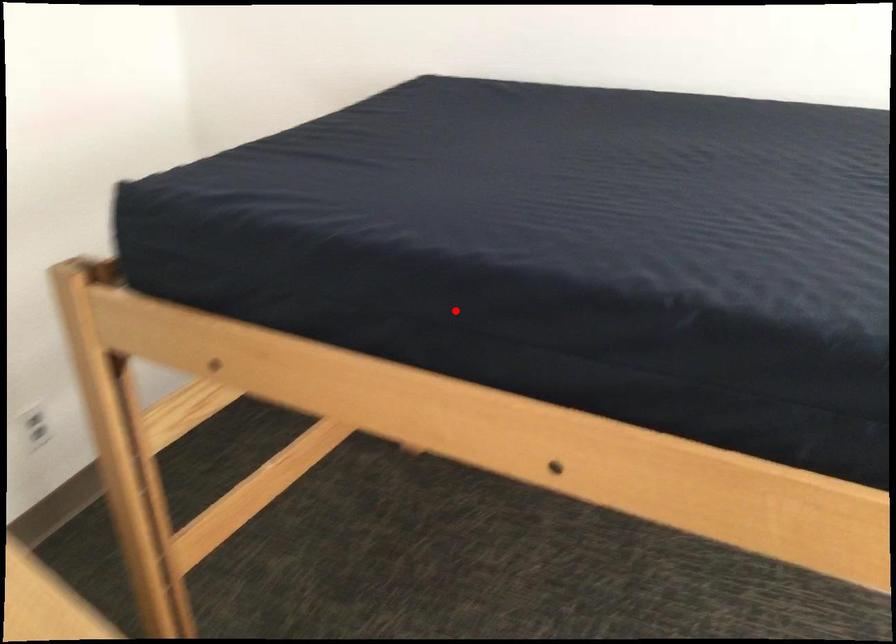
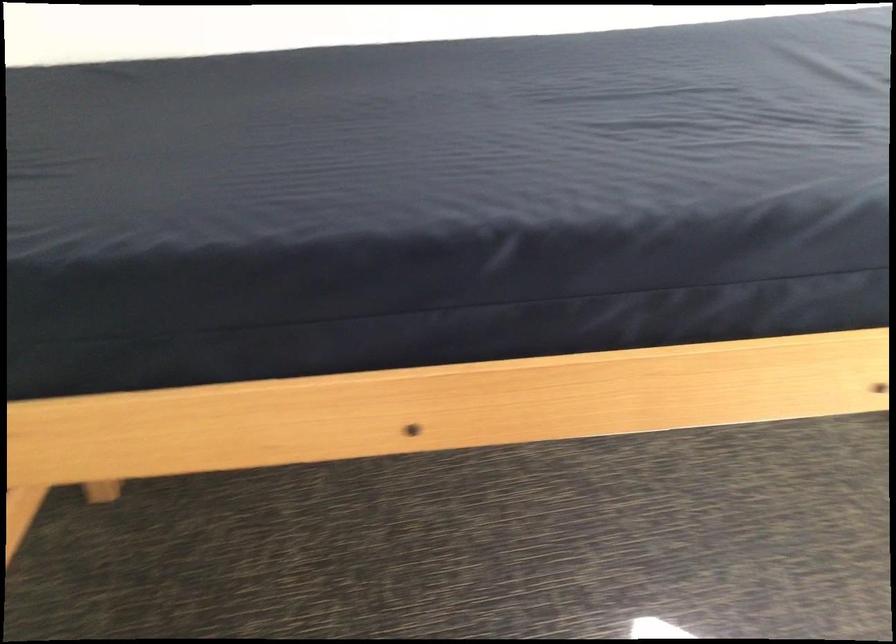
Question: I am providing you with two images of the same scene from different viewpoints. Given a red point in image1, look at the same physical point in image2. Is it:

Choices:
 (A) Closer to the viewpoint
 (B) Farther from the viewpoint

Answer: (A)